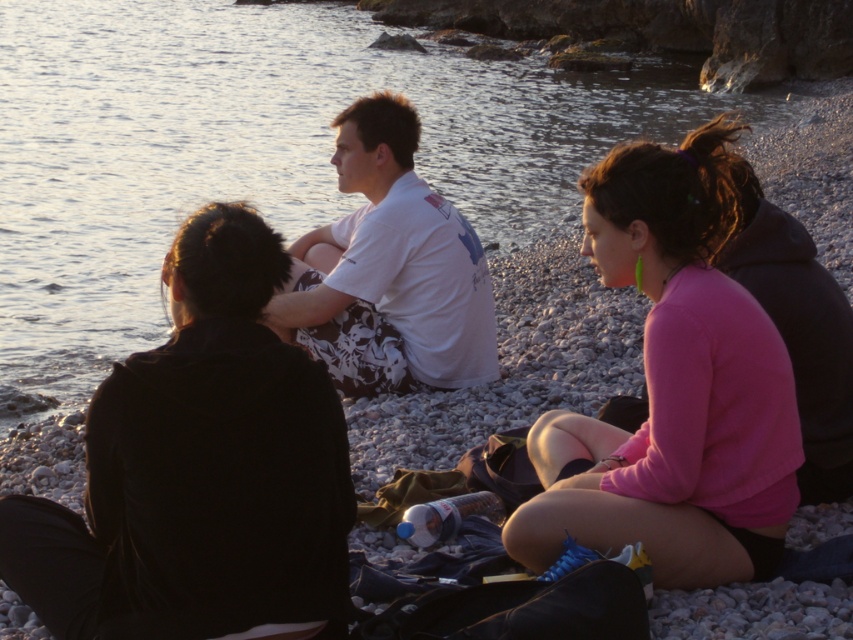
You are standing at the point labeled point [44,368] and want to walk to the point labeled point [779,403]. Will you have to walk towards the water or away from it?

Since point [44,368] is behind point [779,403], you would need to walk towards the water to reach it.

You are a photographer trying to capture a group photo of the black matte jacket at left and the white printed shirt at center. Since you want to ensure both subjects are in focus, you need to know which one is closer to the camera. Can you determine which is closer based on their sizes in the image?

The black matte jacket at left is thinner than the white printed shirt at center, so the black matte jacket at left is closer to the camera.